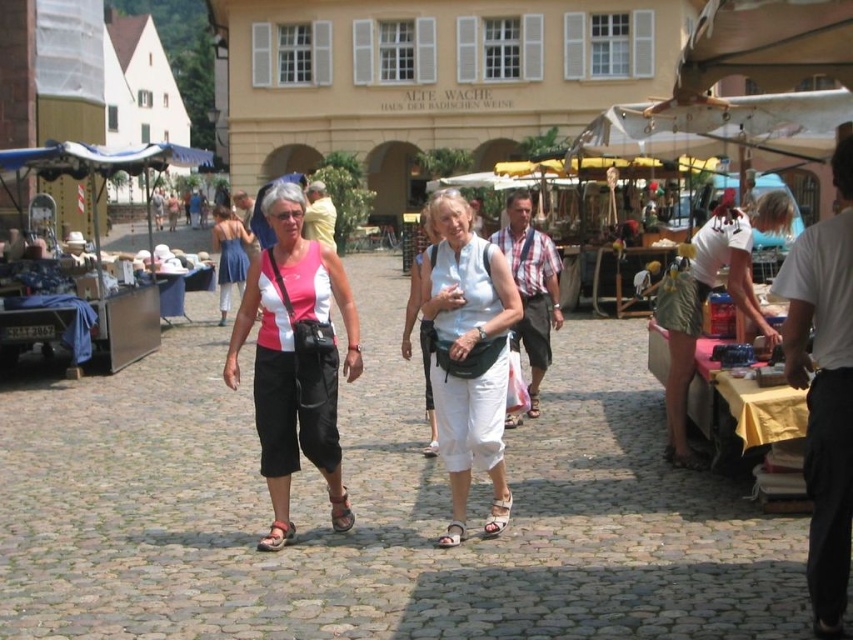
You are a fashion designer observing the two items in the market scene. You need to decide which item is larger in size between the pink fabric top at center and the brown leather sandal at center. Which one is bigger?

The pink fabric top at center is bigger than the brown leather sandal at center.